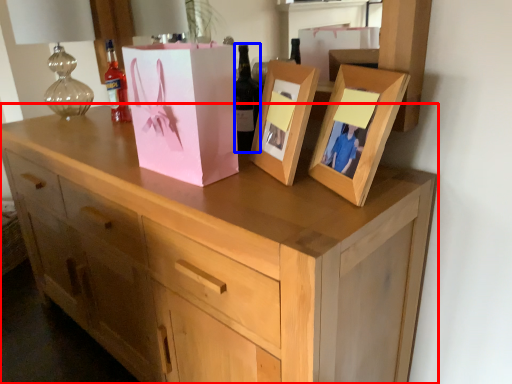
Question: Among these objects, which one is farthest to the camera, chest of drawers (highlighted by a red box) or bottle (highlighted by a blue box)?

Choices:
 (A) chest of drawers
 (B) bottle

Answer: (B)